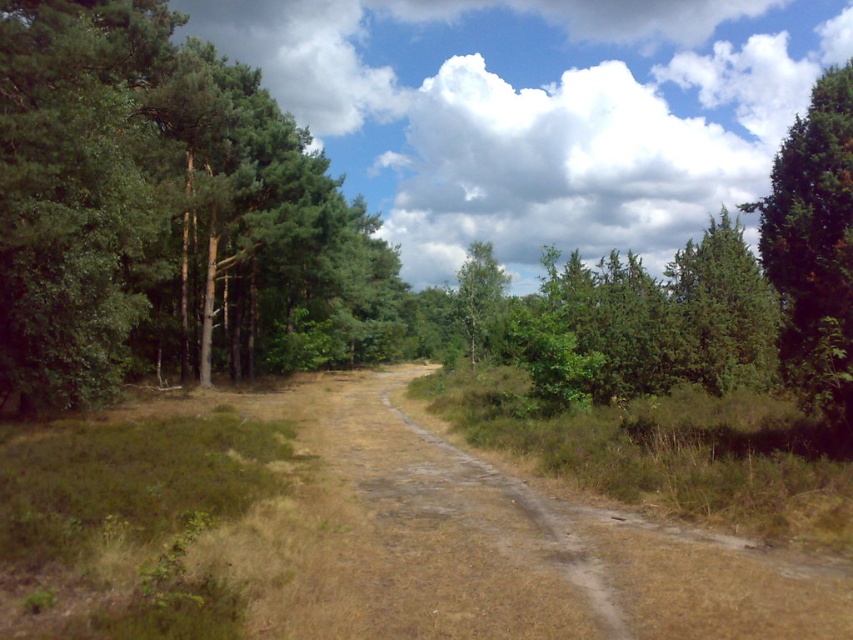
Between green leafy trees at left and green textured tree at right, which one is positioned lower?

green leafy trees at left is below.

Which of these two, green leafy trees at left or green textured tree at right, stands taller?

green textured tree at right

This screenshot has height=640, width=853. What do you see at coordinates (163, 211) in the screenshot?
I see `green leafy trees at left` at bounding box center [163, 211].

Identify the location of green leafy trees at left. The width and height of the screenshot is (853, 640). (163, 211).

Is green leafy trees at left closer to camera compared to green leafy tree at center?

Yes.

Between point (129, 298) and point (462, 289), which one is positioned in front?

Point (129, 298) is more forward.

Which is in front, point (61, 342) or point (473, 301)?

Positioned in front is point (61, 342).

At what (x,y) coordinates should I click in order to perform the action: click on green leafy trees at left. Please return your answer as a coordinate pair (x, y). The image size is (853, 640). Looking at the image, I should click on (163, 211).

Is green textured tree at right closer to camera compared to green leafy tree at center?

Yes, green textured tree at right is closer to the viewer.

Which is more to the right, green textured tree at right or green leafy tree at center?

green textured tree at right

This screenshot has height=640, width=853. What do you see at coordinates (720, 310) in the screenshot? I see `green textured tree at right` at bounding box center [720, 310].

This screenshot has height=640, width=853. I want to click on green textured tree at right, so click(x=720, y=310).